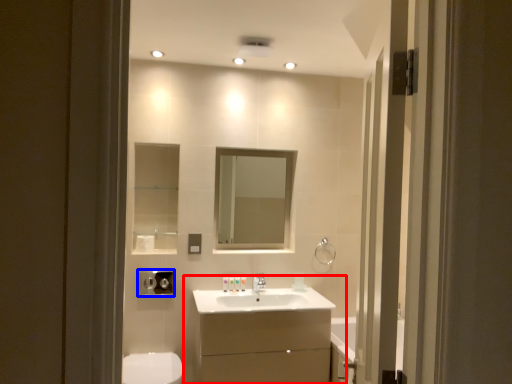
Question: Among these objects, which one is farthest to the camera, bathroom cabinet (highlighted by a red box) or hand dryer (highlighted by a blue box)?

Choices:
 (A) bathroom cabinet
 (B) hand dryer

Answer: (B)